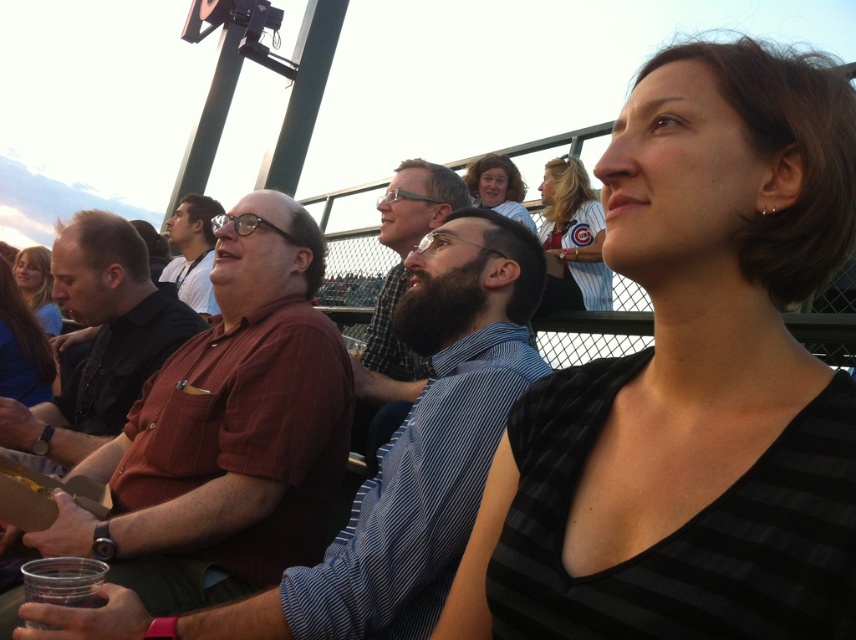
You are a photographer at the baseball game and want to take a photo of the bearded man at center and the matte brown hair at upper center. Which one will appear larger in the photo?

The bearded man at center will appear larger in the photo because he is taller than the matte brown hair at upper center.

You are standing at the point labeled as point (476, 186) and want to throw a ball to point (379, 236). Considering the spatial relationship between these two points, will the ball land closer to the front or back of the area where the second point is located?

The ball will land closer to the front of the area where point (379, 236) is located because point (379, 236) is in front of point (476, 186).

You are a photographer at the event and want to take a picture of the white striped jersey at upper center. Where exactly should you aim your camera?

You should aim your camera at point (572, 240) to capture the white striped jersey at upper center.